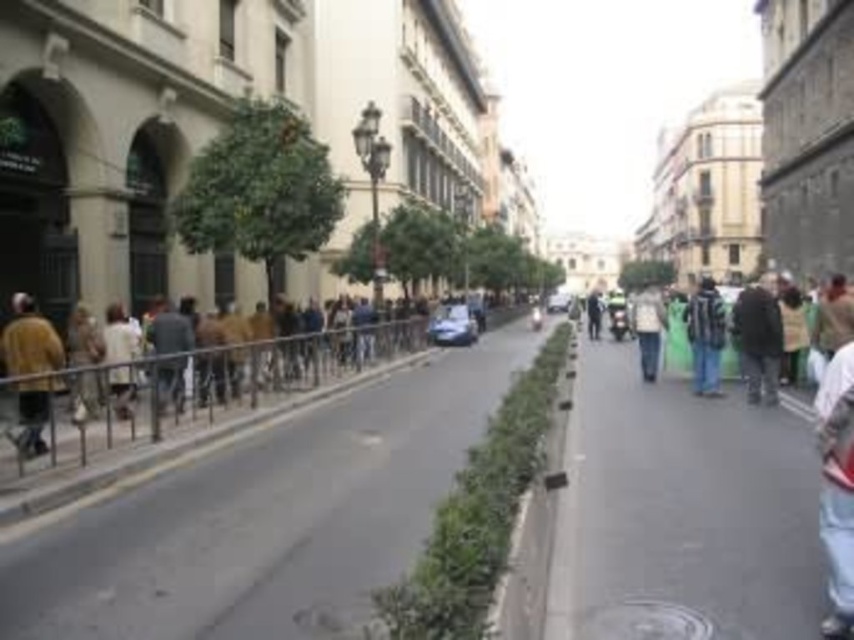
In the scene shown: Can you confirm if brown leather jacket at left is thinner than dark green jacket at right?

Yes.

Does point (34, 428) come farther from viewer compared to point (700, 387)?

No, it is in front of (700, 387).

This screenshot has width=854, height=640. Identify the location of brown leather jacket at left. (30, 339).

Is the position of concrete sidewalk at left more distant than that of dark green jacket at right?

No, concrete sidewalk at left is closer to the viewer.

Which is in front, point (335, 547) or point (718, 294)?

Point (335, 547) is in front.

Identify the location of concrete sidewalk at left. This screenshot has height=640, width=854. (266, 515).

Which of these two, brown leather jacket at left or dark brown leather jacket at right, stands taller?

Standing taller between the two is dark brown leather jacket at right.

Does point (42, 419) lie behind point (765, 353)?

No, it is not.

At what (x,y) coordinates should I click in order to perform the action: click on brown leather jacket at left. Please return your answer as a coordinate pair (x, y). This screenshot has width=854, height=640. Looking at the image, I should click on (30, 339).